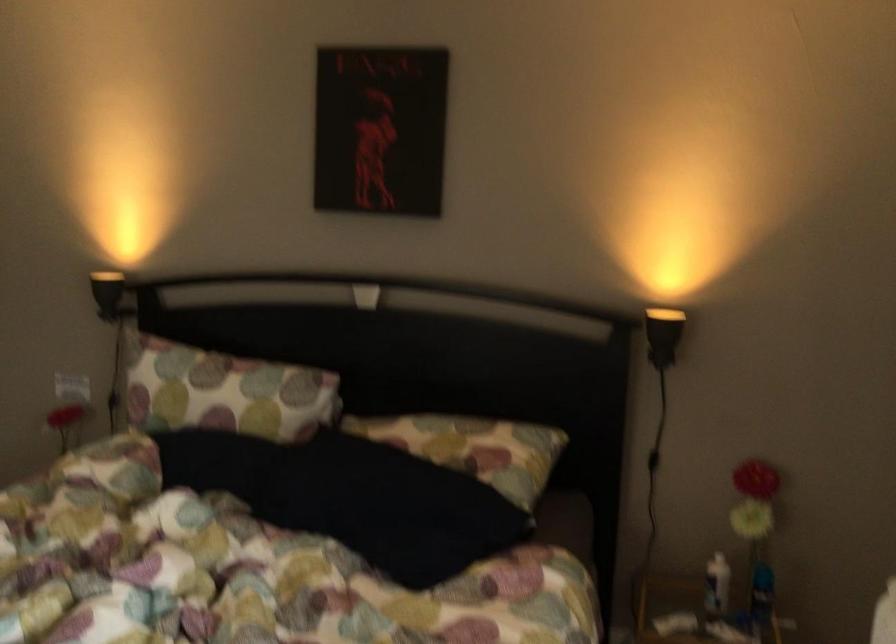
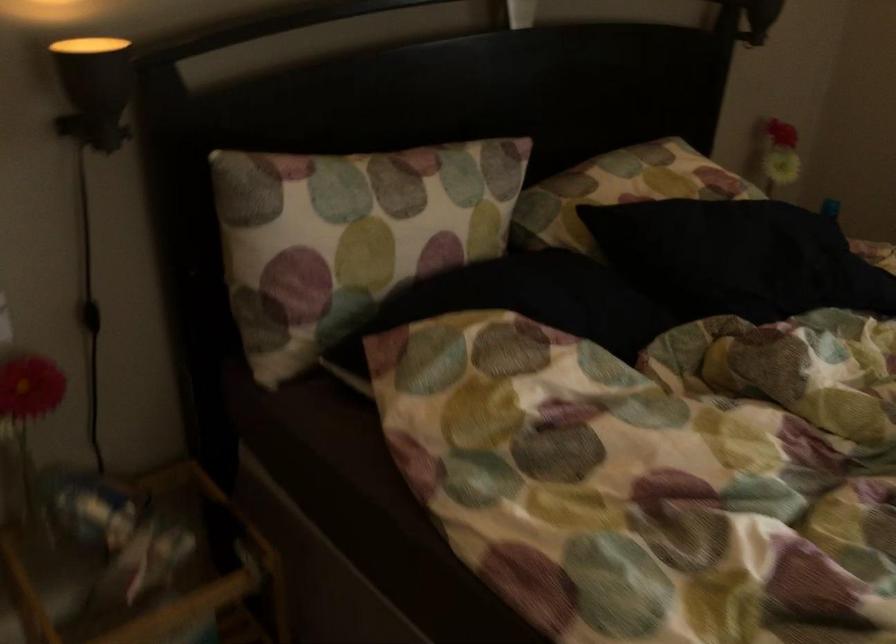
Where in the second image is the point corresponding to point (115, 397) from the first image?

(90, 316)